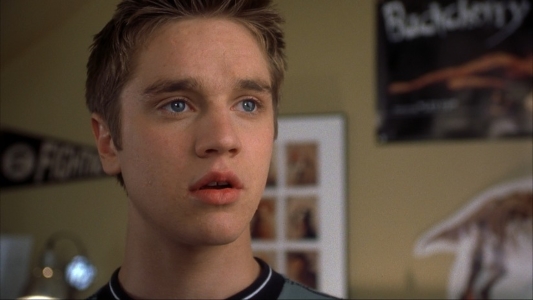
What are the coordinates of `beige painted wall` in the screenshot? It's located at (25, 38), (72, 33), (59, 108), (108, 224), (42, 218), (327, 41), (379, 194), (463, 172), (381, 257).